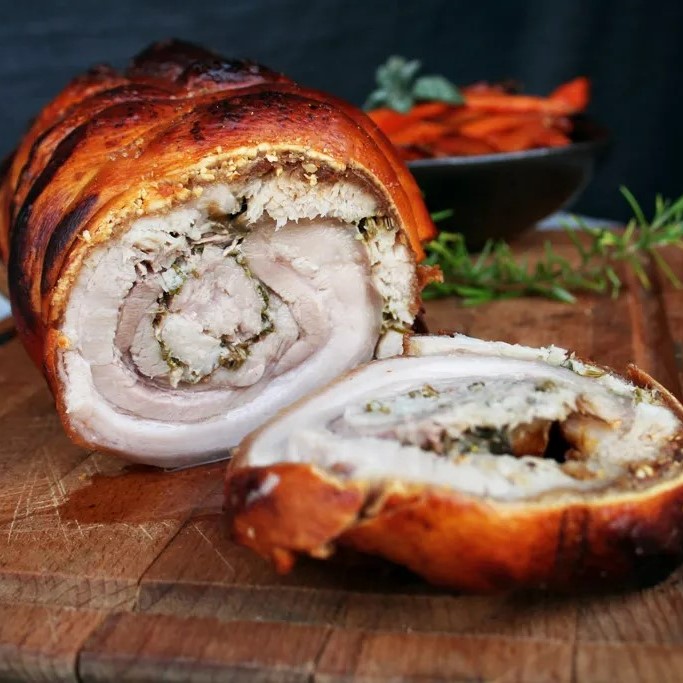
This screenshot has height=683, width=683. Identify the location of ridge in cutting board. (100, 596).